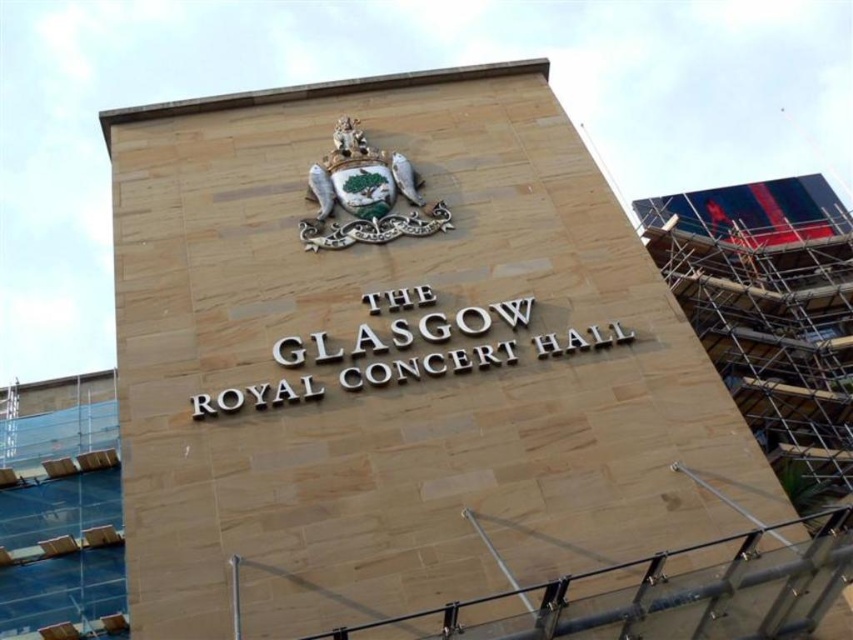
From the picture: Is the position of scaffolding at right less distant than that of enamel crest at upper center?

No, it is behind enamel crest at upper center.

Is point (840, 250) positioned after point (401, 177)?

Yes, point (840, 250) is behind point (401, 177).

At what (x,y) coordinates should I click in order to perform the action: click on scaffolding at right. Please return your answer as a coordinate pair (x, y). Looking at the image, I should click on (770, 314).

Where is `scaffolding at right`? The image size is (853, 640). scaffolding at right is located at coordinates (770, 314).